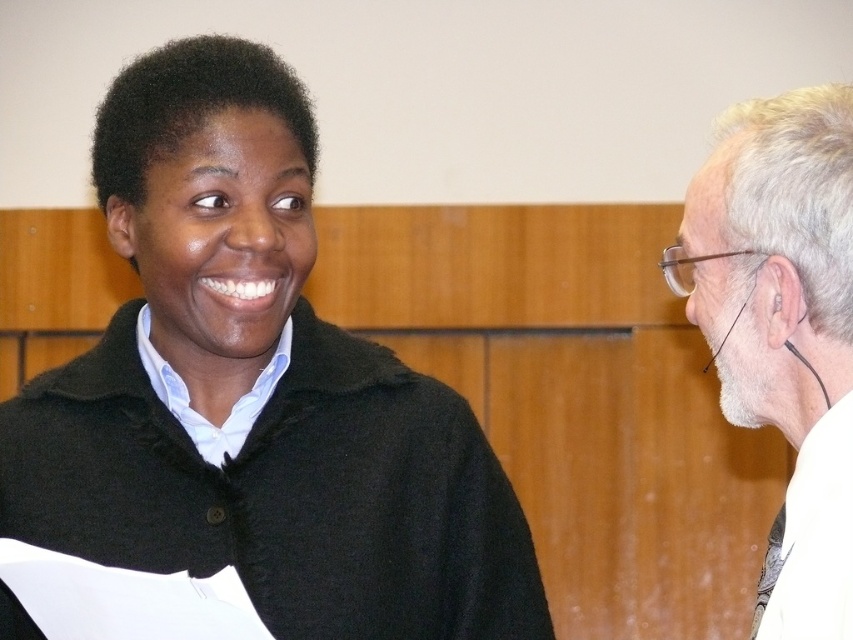
Question: Among these points, which one is nearest to the camera?

Choices:
 (A) (827, 428)
 (B) (366, 497)

Answer: (A)

Question: Which point is farther to the camera?

Choices:
 (A) (270, 360)
 (B) (740, 131)

Answer: (A)

Question: Does black wool sweater at upper left have a smaller size compared to white hair at right?

Choices:
 (A) no
 (B) yes

Answer: (A)

Question: Which point appears farthest from the camera in this image?

Choices:
 (A) (741, 122)
 (B) (183, 349)

Answer: (B)

Question: Does black wool sweater at upper left have a smaller size compared to white hair at right?

Choices:
 (A) yes
 (B) no

Answer: (B)

Question: Can you confirm if black wool sweater at upper left is positioned to the right of white hair at right?

Choices:
 (A) no
 (B) yes

Answer: (A)